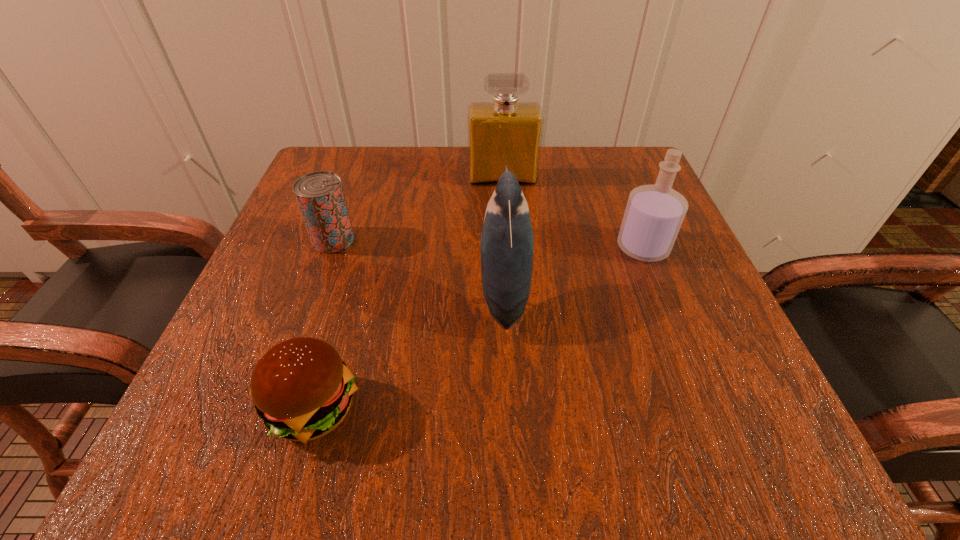
In order to click on free space between the hamburger and the rightmost object in this screenshot , I will do `click(478, 328)`.

Identify the location of empty space between the farther perfume and the right perfume. (572, 213).

Locate an element on the screen. The width and height of the screenshot is (960, 540). unoccupied position between the right perfume and the bird is located at coordinates (573, 272).

Find the location of a particular element. Image resolution: width=960 pixels, height=540 pixels. free space between the farther perfume and the right perfume is located at coordinates (572, 213).

Identify which object is located as the nearest to the nearer perfume. Please provide its 2D coordinates. Your answer should be formatted as a tuple, i.e. [(x, y)], where the tuple contains the x and y coordinates of a point satisfying the conditions above.

[(507, 243)]

Find the location of a particular element. The height and width of the screenshot is (540, 960). object that is the fourth closest one to the farther perfume is located at coordinates (302, 389).

Find the location of a particular element. vacant space that satisfies the following two spatial constraints: 1. on the front side of the right perfume; 2. on the left side of the beer can is located at coordinates (330, 248).